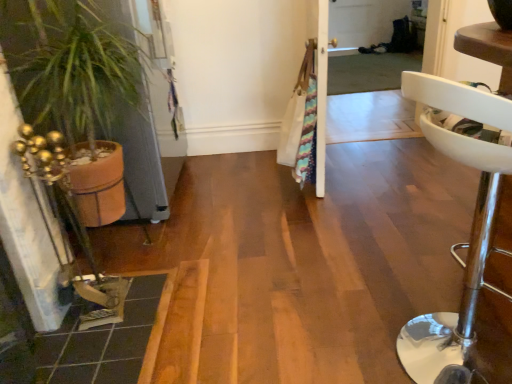
At what (x,y) coordinates should I click in order to perform the action: click on transparent plastic screen door at upper center. Please return your answer as a coordinate pair (x, y). The image size is (512, 384). Looking at the image, I should click on (368, 73).

Which is correct: transparent plastic screen door at upper center is inside terracotta pot at left, or outside of it?

→ transparent plastic screen door at upper center is not inside terracotta pot at left, it's outside.

Consider the image. From a real-world perspective, is transparent plastic screen door at upper center positioned over terracotta pot at left based on gravity?

No, from a real-world perspective, transparent plastic screen door at upper center is not over terracotta pot at left

Does point (340, 31) appear closer or farther from the camera than point (155, 200)?

Point (340, 31) is positioned farther from the camera compared to point (155, 200).

Could you tell me if transparent plastic screen door at upper center is facing terracotta pot at left?

No, transparent plastic screen door at upper center is not facing towards terracotta pot at left.

Is white leather stool at right wider or thinner than transparent plastic screen door at upper center?

In the image, white leather stool at right appears to be wider than transparent plastic screen door at upper center.

Between white leather stool at right and transparent plastic screen door at upper center, which one has smaller size?

With smaller size is white leather stool at right.

The height and width of the screenshot is (384, 512). Find the location of `furniture located in front of the transparent plastic screen door at upper center`. furniture located in front of the transparent plastic screen door at upper center is located at coordinates (472, 224).

Measure the distance from white leather stool at right to transparent plastic screen door at upper center.

9.14 feet.

Relative to white leather stool at right, is transparent plastic screen door at upper center in front or behind?

Clearly, transparent plastic screen door at upper center is behind white leather stool at right.

From the image's perspective, is transparent plastic screen door at upper center above or below white leather stool at right?

transparent plastic screen door at upper center is situated higher than white leather stool at right in the image.

Is transparent plastic screen door at upper center taller or shorter than white leather stool at right?

In the image, transparent plastic screen door at upper center appears to be taller than white leather stool at right.

Is transparent plastic screen door at upper center looking in the opposite direction of white leather stool at right?

No.

How much distance is there between terracotta pot at left and white leather stool at right?

terracotta pot at left is 4.13 feet from white leather stool at right.

Could white leather stool at right be considered to be inside terracotta pot at left?

No, terracotta pot at left does not contain white leather stool at right.

Between terracotta pot at left and white leather stool at right, which one has larger size?

With larger size is terracotta pot at left.

Can you confirm if terracotta pot at left is positioned to the right of white leather stool at right?

No, terracotta pot at left is not to the right of white leather stool at right.

From the image's perspective, is terracotta pot at left positioned above or below transparent plastic screen door at upper center?

terracotta pot at left is situated lower than transparent plastic screen door at upper center in the image.

In the scene shown: Considering the sizes of objects terracotta pot at left and transparent plastic screen door at upper center in the image provided, who is shorter, terracotta pot at left or transparent plastic screen door at upper center?

transparent plastic screen door at upper center is shorter.

Is terracotta pot at left not near transparent plastic screen door at upper center?

terracotta pot at left is positioned a significant distance from transparent plastic screen door at upper center.

From a real-world perspective, is terracotta pot at left located beneath transparent plastic screen door at upper center?

No, from a real-world perspective, terracotta pot at left is not below transparent plastic screen door at upper center.

In terms of width, does white leather stool at right look wider or thinner when compared to terracotta pot at left?

white leather stool at right is thinner than terracotta pot at left.

From the image's perspective, relative to terracotta pot at left, is white leather stool at right above or below?

From the image's perspective, white leather stool at right appears below terracotta pot at left.

Does white leather stool at right have a lesser height compared to terracotta pot at left?

Correct, white leather stool at right is not as tall as terracotta pot at left.

From a real-world perspective, is white leather stool at right on top of terracotta pot at left?

Incorrect, from a real-world perspective, white leather stool at right is lower than terracotta pot at left.

Find the location of a particular element. screen door above the terracotta pot at left (from the image's perspective) is located at coordinates (368, 73).

Image resolution: width=512 pixels, height=384 pixels. Find the location of `screen door on the right of white leather stool at right`. screen door on the right of white leather stool at right is located at coordinates (368, 73).

Which object lies further to the anchor point white leather stool at right, terracotta pot at left or transparent plastic screen door at upper center?

transparent plastic screen door at upper center lies further to white leather stool at right than the other object.

Based on the photo, when comparing their distances from white leather stool at right, does transparent plastic screen door at upper center or terracotta pot at left seem closer?

terracotta pot at left is closer to white leather stool at right.

Estimate the real-world distances between objects in this image. Which object is further from terracotta pot at left, transparent plastic screen door at upper center or white leather stool at right?

transparent plastic screen door at upper center is positioned further to the anchor terracotta pot at left.

Looking at the image, which one is located further to terracotta pot at left, white leather stool at right or transparent plastic screen door at upper center?

Based on the image, transparent plastic screen door at upper center appears to be further to terracotta pot at left.

Looking at the image, which one is located further to transparent plastic screen door at upper center, terracotta pot at left or white leather stool at right?

white leather stool at right.

In the scene shown: When comparing their distances from transparent plastic screen door at upper center, does white leather stool at right or terracotta pot at left seem further?

Among the two, white leather stool at right is located further to transparent plastic screen door at upper center.

The image size is (512, 384). Identify the location of houseplant between white leather stool at right and transparent plastic screen door at upper center from front to back. (87, 85).